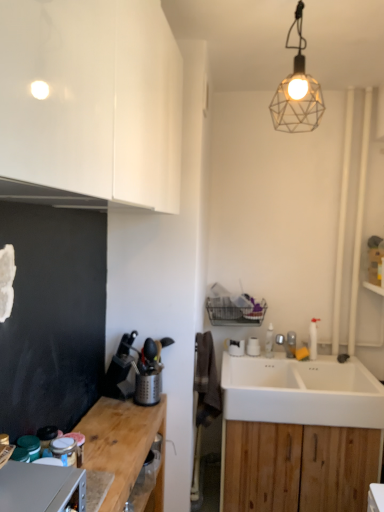
Where is `free space to the left of metallic grater at left, which appears as the third appliance when viewed from the front`? This screenshot has width=384, height=512. free space to the left of metallic grater at left, which appears as the third appliance when viewed from the front is located at coordinates coord(115,404).